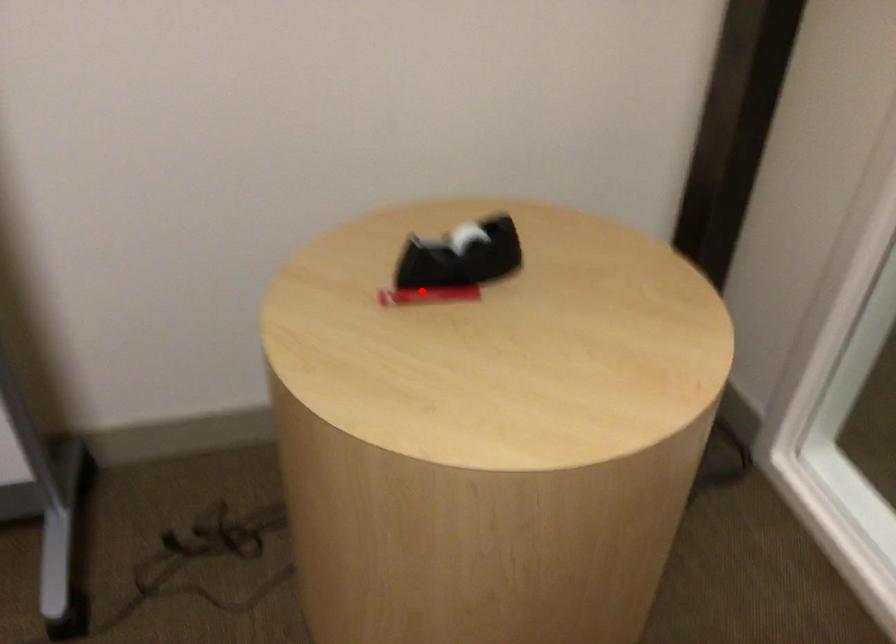
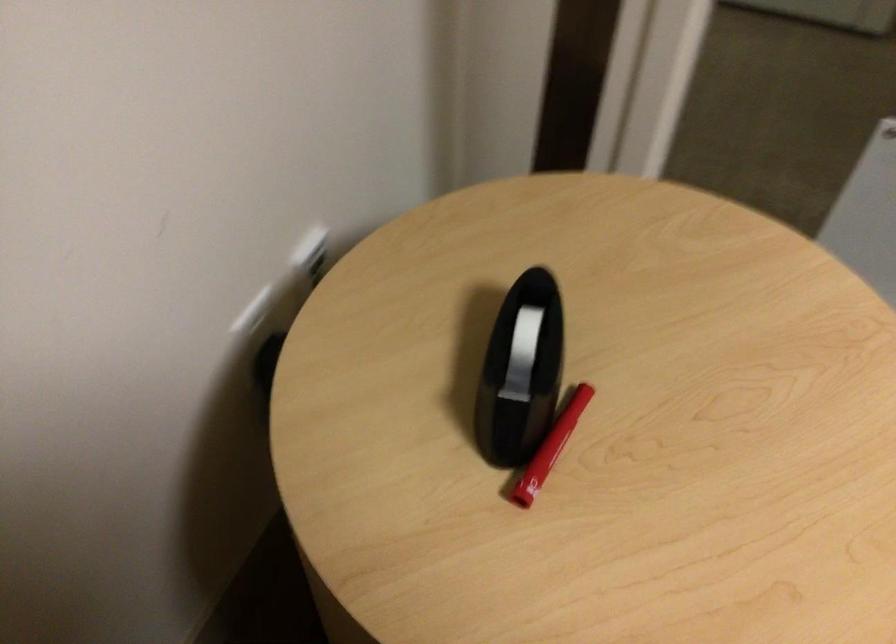
Question: I am providing you with two images of the same scene from different viewpoints. Image1 has a red point marked. In image2, the corresponding 3D location appears at what relative position? Reply with the corresponding letter.

Choices:
 (A) Closer
 (B) Farther

Answer: (A)